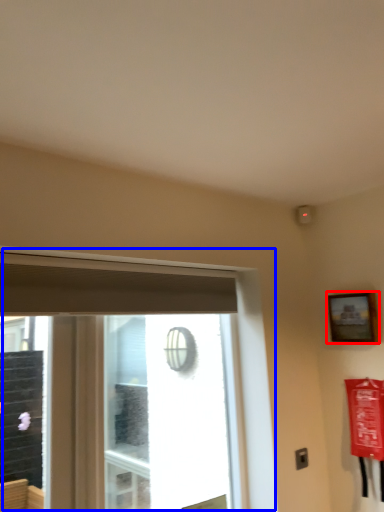
Question: Which of the following is the closest to the observer, picture frame (highlighted by a red box) or window (highlighted by a blue box)?

Choices:
 (A) picture frame
 (B) window

Answer: (B)